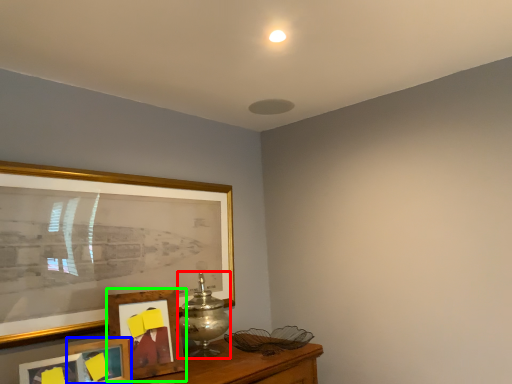
Question: Based on their relative distances, which object is nearer to table lamp (highlighted by a red box)? Choose from picture frame (highlighted by a blue box) and picture frame (highlighted by a green box).

Choices:
 (A) picture frame
 (B) picture frame

Answer: (B)